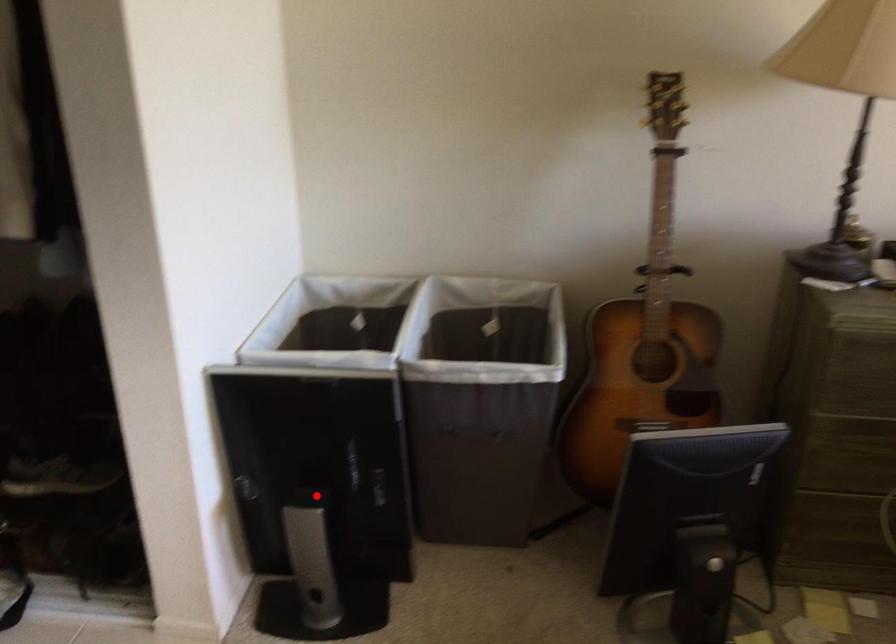
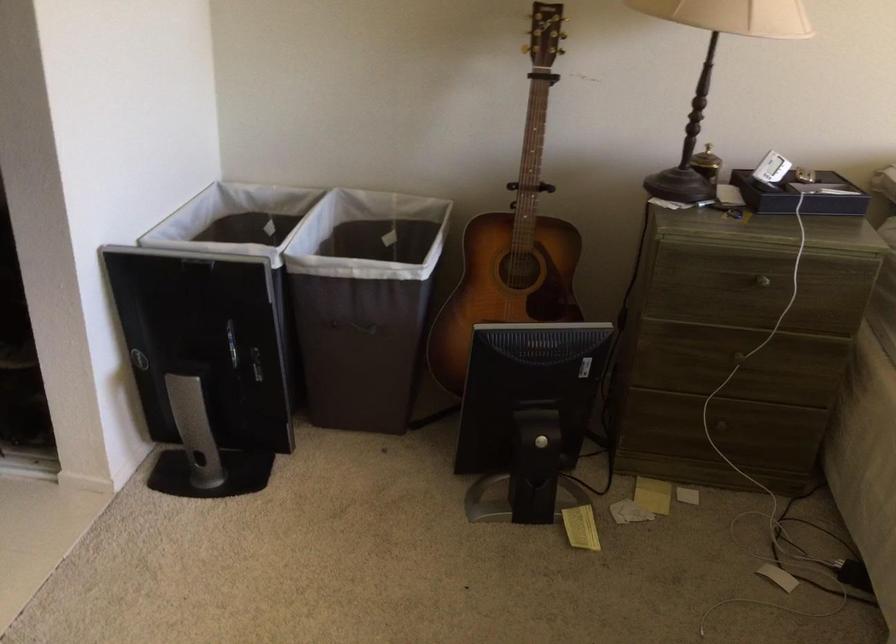
Question: I am providing you with two images of the same scene from different viewpoints. A red point is marked on the first image. Is the red point's position out of view in image 2?

Choices:
 (A) Yes
 (B) No

Answer: (B)